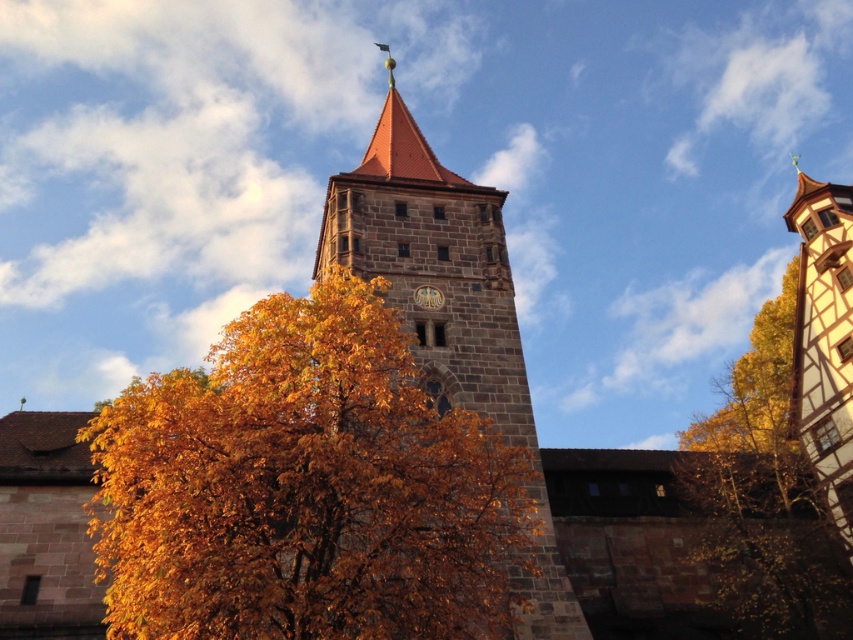
Question: Is yellow leaves at upper right to the left of wooden half-timbered house at right from the viewer's perspective?

Choices:
 (A) no
 (B) yes

Answer: (B)

Question: Which point appears farthest from the camera in this image?

Choices:
 (A) (495, 330)
 (B) (775, 337)
 (C) (415, 298)

Answer: (B)

Question: Does golden-brown leaves at center appear under dark brown stone clock at center?

Choices:
 (A) no
 (B) yes

Answer: (B)

Question: Which point appears farthest from the camera in this image?

Choices:
 (A) (780, 516)
 (B) (459, 392)
 (C) (843, 220)

Answer: (C)

Question: Estimate the real-world distances between objects in this image. Which object is closer to the yellow leaves at upper right?

Choices:
 (A) dark brown stone clock at center
 (B) golden-brown leaves at center

Answer: (B)

Question: Is golden-brown leaves at center thinner than wooden half-timbered house at right?

Choices:
 (A) no
 (B) yes

Answer: (A)